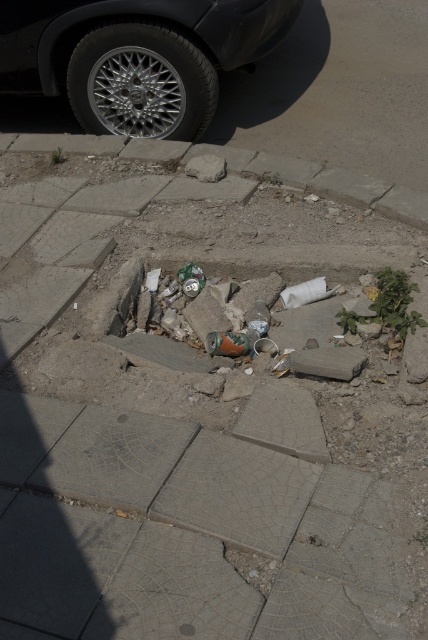
You are a delivery robot navigating through the damaged sidewalk. You need to move from your current position to the delivery point located at point (192, 44). However, there is an obstacle at point (210, 28) blocking your path. Since the obstacle is in front of your destination, can you safely navigate around it to reach your destination?

Point (210, 28) is in front of point (192, 44), so the obstacle is blocking the path. The delivery robot cannot safely navigate around it to reach the destination.